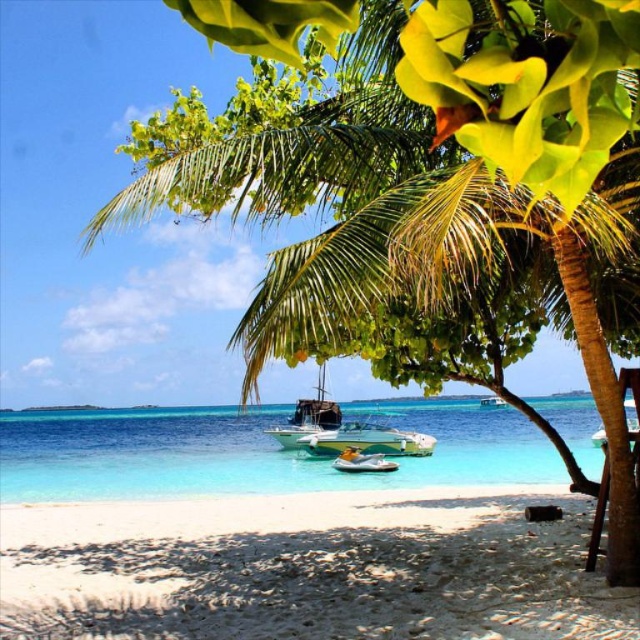
Which is above, white sandy beach at lower center or clear blue water at lower left?

white sandy beach at lower center

Does point (568, 634) come behind point (563, 477)?

No, (568, 634) is closer to viewer.

Between point (157, 515) and point (218, 449), which one is positioned behind?

Positioned behind is point (218, 449).

Find the location of `white sandy beach at lower center`. white sandy beach at lower center is located at coordinates (307, 570).

Can you confirm if wooden sailboat at center is positioned below white glossy boat at center?

Yes.

Between point (301, 429) and point (600, 435), which one is positioned behind?

Point (600, 435)

Locate an element on the screen. The width and height of the screenshot is (640, 640). wooden sailboat at center is located at coordinates (308, 417).

Can you confirm if clear blue water at lower left is wider than wooden sailboat at center?

Indeed, clear blue water at lower left has a greater width compared to wooden sailboat at center.

Does clear blue water at lower left appear on the left side of wooden sailboat at center?

Correct, you'll find clear blue water at lower left to the left of wooden sailboat at center.

At what (x,y) coordinates should I click in order to perform the action: click on clear blue water at lower left. Please return your answer as a coordinate pair (x, y). The width and height of the screenshot is (640, 640). Looking at the image, I should click on (252, 452).